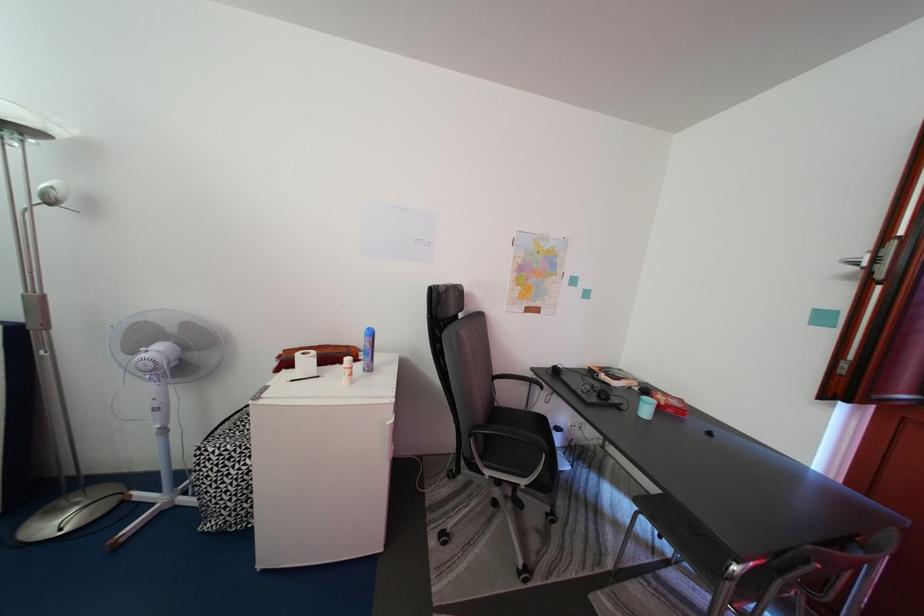
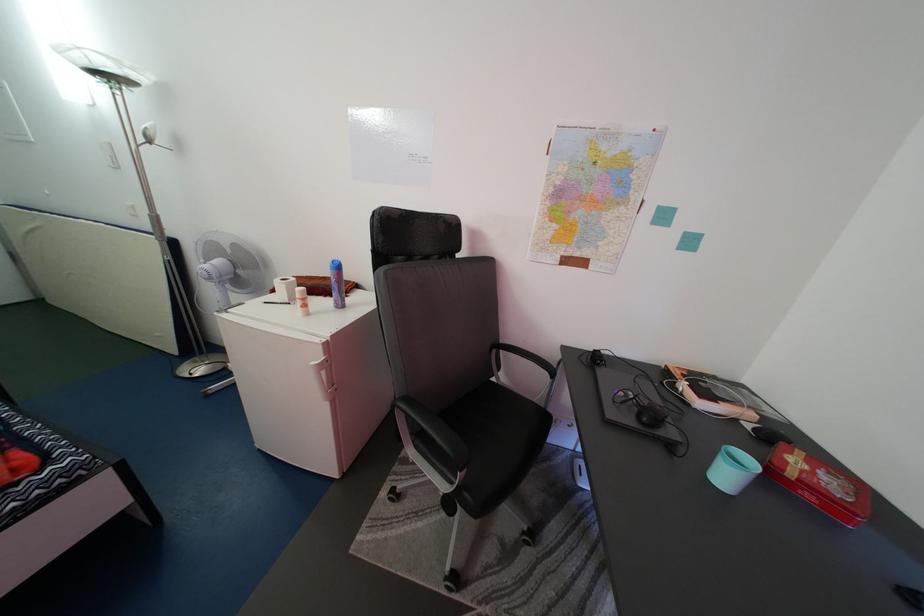
Locate, in the second image, the point that corresponds to (x=612, y=383) in the first image.

(691, 392)